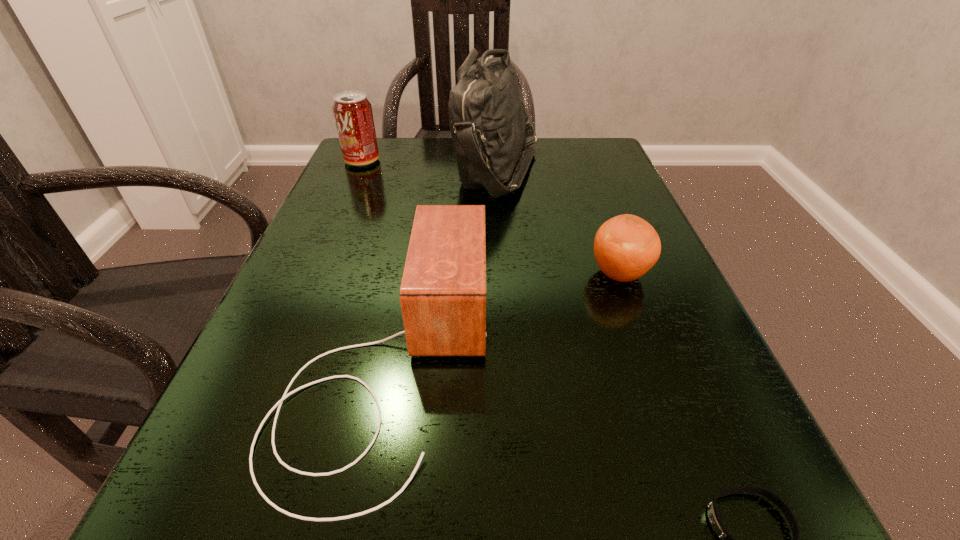
Locate an element on the screen. The height and width of the screenshot is (540, 960). object that is the second closest one to the fourth shortest object is located at coordinates (443, 291).

You are a GUI agent. You are given a task and a screenshot of the screen. Output one action in this format:
    pyautogui.click(x=<x>, y=<y>)
    Task: Click on the vacant space that satisfies the following two spatial constraints: 1. on the front side of the second shortest object; 2. on the front-facing side of the radio receiver
    This screenshot has height=540, width=960.
    Given the screenshot: What is the action you would take?
    pyautogui.click(x=652, y=361)

At what (x,y) coordinates should I click in order to perform the action: click on vacant space that satisfies the following two spatial constraints: 1. on the front side of the soda can; 2. on the right side of the fourth tallest object. Please return your answer as a coordinate pair (x, y). Looking at the image, I should click on (312, 274).

Find the location of a particular element. The image size is (960, 540). free spot that satisfies the following two spatial constraints: 1. at the front padded panel of the orange; 2. on the left side of the tallest object is located at coordinates (504, 274).

Where is `free spot that satisfies the following two spatial constraints: 1. on the front side of the fourth tallest object; 2. on the right side of the fourth shortest object`? The width and height of the screenshot is (960, 540). free spot that satisfies the following two spatial constraints: 1. on the front side of the fourth tallest object; 2. on the right side of the fourth shortest object is located at coordinates click(312, 274).